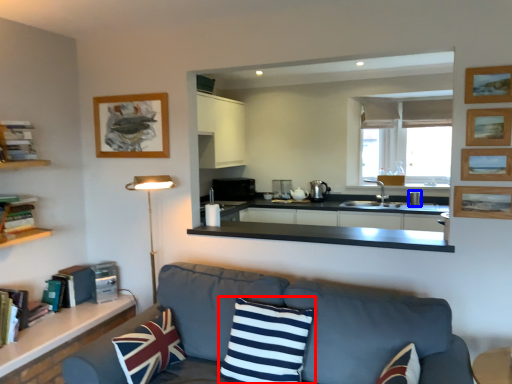
Question: Which object appears closest to the camera in this image, pillow (highlighted by a red box) or appliance (highlighted by a blue box)?

Choices:
 (A) pillow
 (B) appliance

Answer: (A)